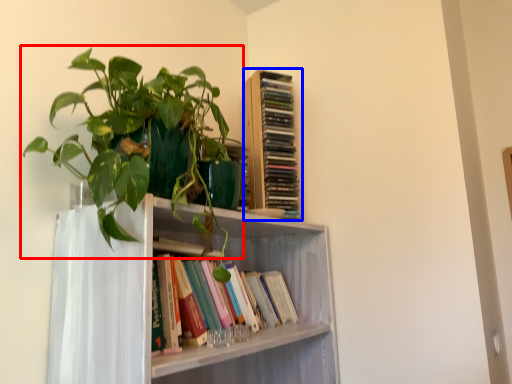
Question: Which object is further to the camera taking this photo, houseplant (highlighted by a red box) or book (highlighted by a blue box)?

Choices:
 (A) houseplant
 (B) book

Answer: (B)